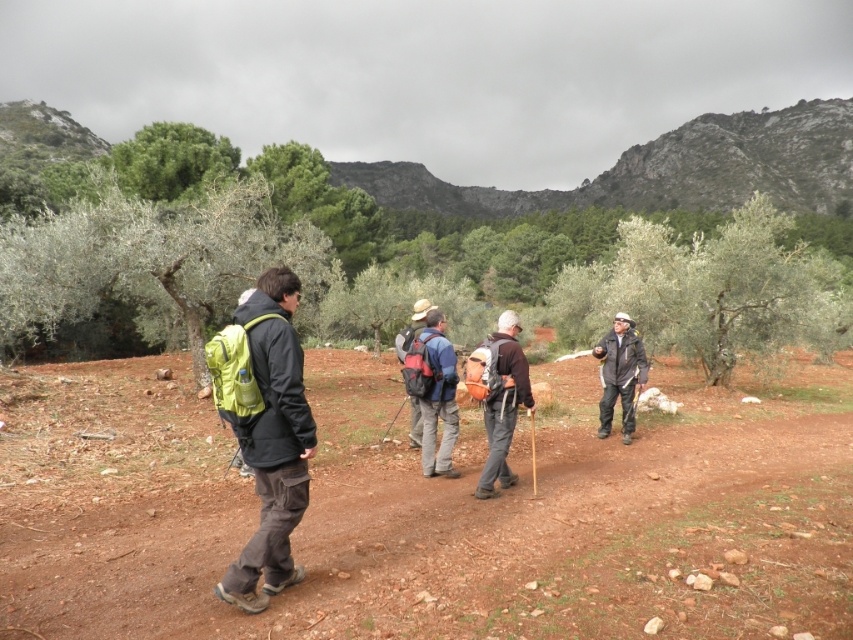
Is green leafy tree at center thinner than green leafy tree at left?

In fact, green leafy tree at center might be wider than green leafy tree at left.

Which is more to the left, green leafy tree at center or green leafy tree at left?

From the viewer's perspective, green leafy tree at left appears more on the left side.

Does point (7, 337) come behind point (149, 252)?

Yes, point (7, 337) is behind point (149, 252).

This screenshot has height=640, width=853. I want to click on green leafy tree at center, so click(693, 236).

Does red backpack at center appear on the left side of dark gray jacket at center?

Yes, red backpack at center is to the left of dark gray jacket at center.

Between red backpack at center and dark gray jacket at center, which one has more height?

red backpack at center is taller.

Locate an element on the screen. red backpack at center is located at coordinates tap(434, 392).

You are a GUI agent. You are given a task and a screenshot of the screen. Output one action in this format:
    pyautogui.click(x=<x>, y=<y>)
    Task: Click on the brown dirt field at center
    
    Given the screenshot: What is the action you would take?
    pyautogui.click(x=428, y=513)

Between brown dirt field at center and matte green backpack at left, which one has less height?

With less height is brown dirt field at center.

Which is in front, point (131, 573) or point (299, 433)?

Positioned in front is point (299, 433).

Where is `brown dirt field at center`? The height and width of the screenshot is (640, 853). brown dirt field at center is located at coordinates (428, 513).